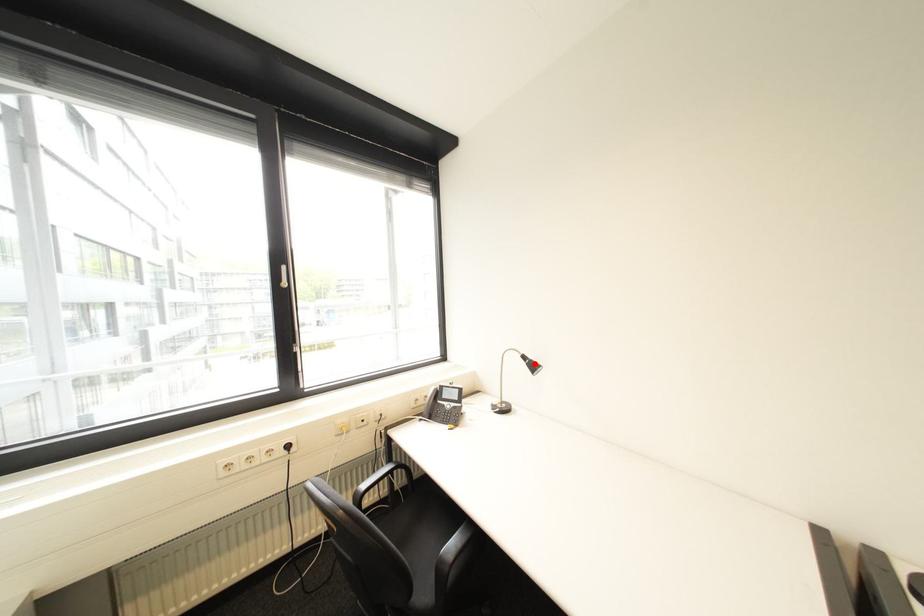
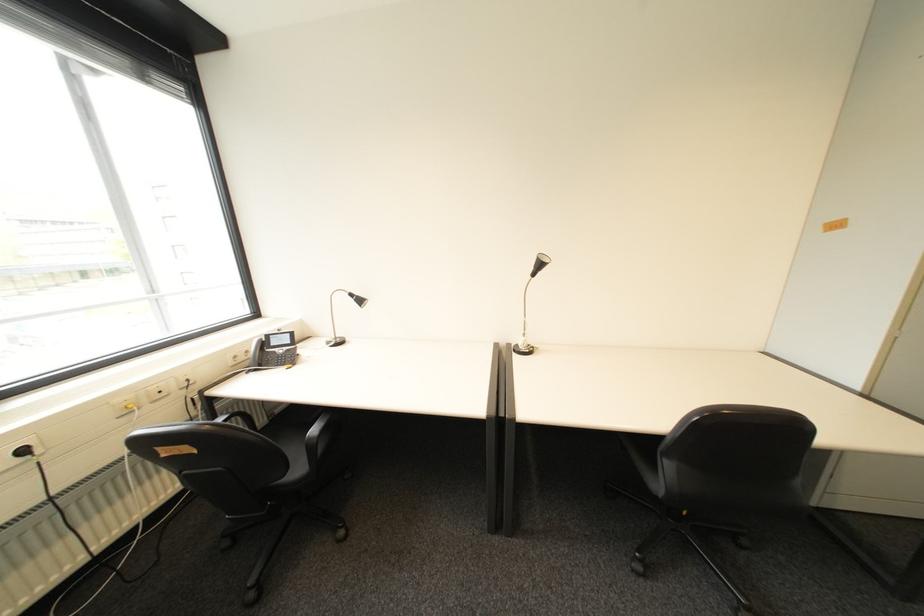
Question: I am providing you with two images of the same scene from different viewpoints. Given a red point in image1, look at the same physical point in image2. Is it:

Choices:
 (A) Closer to the viewpoint
 (B) Farther from the viewpoint

Answer: (A)